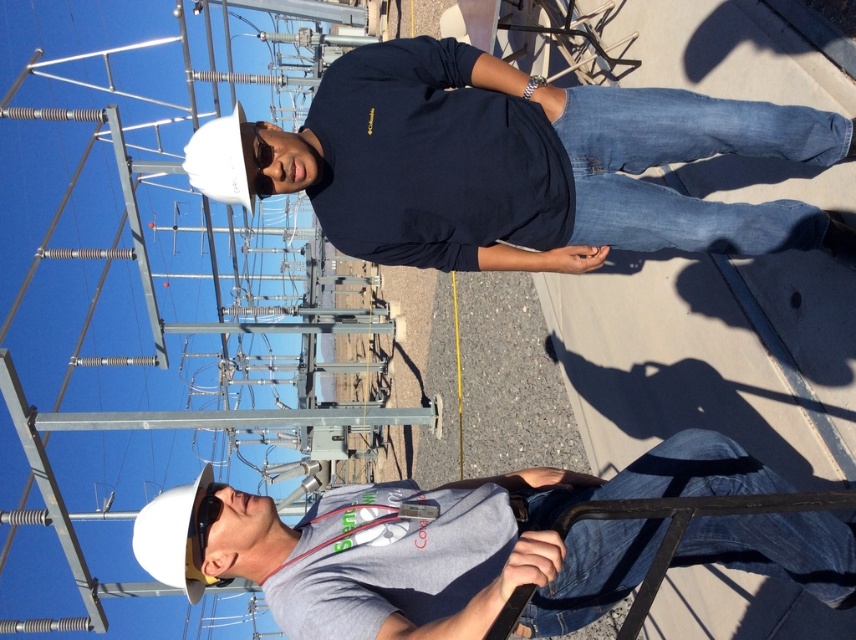
Question: Is dark blue shirt at center positioned before gray matte shirt at center?

Choices:
 (A) no
 (B) yes

Answer: (A)

Question: Among these points, which one is farthest from the camera?

Choices:
 (A) (797, 536)
 (B) (296, 140)

Answer: (B)

Question: Does dark blue shirt at center have a lesser width compared to gray matte shirt at center?

Choices:
 (A) yes
 (B) no

Answer: (A)

Question: Which object appears farthest from the camera in this image?

Choices:
 (A) dark blue shirt at center
 (B) gray matte shirt at center

Answer: (A)

Question: From the image, what is the correct spatial relationship of dark blue shirt at center in relation to gray matte shirt at center?

Choices:
 (A) above
 (B) below

Answer: (A)

Question: Among these objects, which one is nearest to the camera?

Choices:
 (A) dark blue shirt at center
 (B) gray matte shirt at center

Answer: (B)